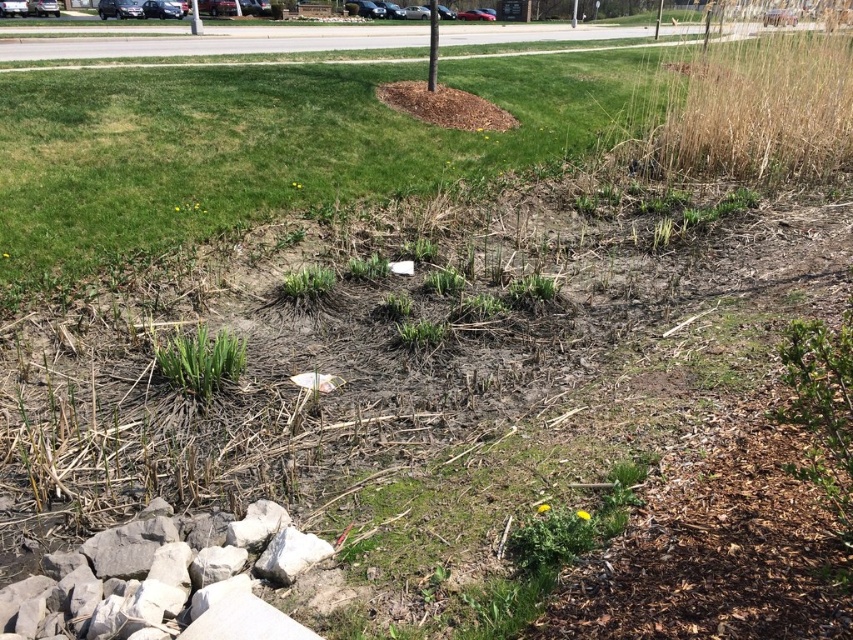
Question: Does green grass at center have a lesser width compared to smooth gray pole at center?

Choices:
 (A) no
 (B) yes

Answer: (A)

Question: Is green grass at center bigger than smooth gray pole at center?

Choices:
 (A) yes
 (B) no

Answer: (B)

Question: Which object appears farthest from the camera in this image?

Choices:
 (A) smooth gray pole at center
 (B) green grass at center

Answer: (A)

Question: Considering the relative positions of green grass at center and smooth gray pole at center in the image provided, where is green grass at center located with respect to smooth gray pole at center?

Choices:
 (A) left
 (B) right

Answer: (A)